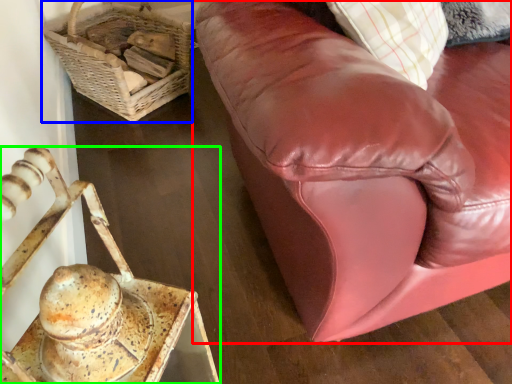
Question: Based on their relative distances, which object is nearer to studio couch (highlighted by a red box)? Choose from basket (highlighted by a blue box) and furniture (highlighted by a green box).

Choices:
 (A) basket
 (B) furniture

Answer: (B)